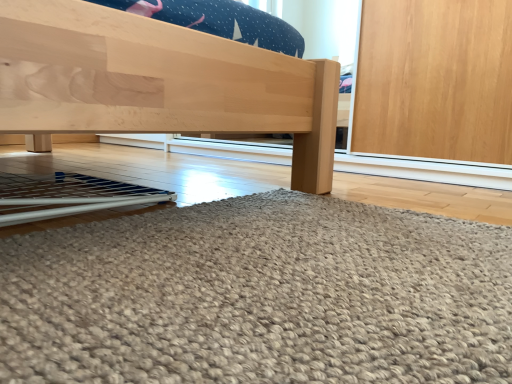
This screenshot has height=384, width=512. I want to click on wooden door at lower right, so click(x=260, y=297).

What do you see at coordinates (260, 297) in the screenshot? I see `wooden door at lower right` at bounding box center [260, 297].

What do you see at coordinates (158, 83) in the screenshot? This screenshot has height=384, width=512. I see `natural wood bed frame at center` at bounding box center [158, 83].

Identify the location of natural wood bed frame at center. point(158,83).

I want to click on wooden door at lower right, so click(260, 297).

Is wooden door at lower right to the right of natural wood bed frame at center from the viewer's perspective?

Indeed, wooden door at lower right is positioned on the right side of natural wood bed frame at center.

Does wooden door at lower right lie behind natural wood bed frame at center?

No, wooden door at lower right is closer to the viewer.

Considering the points (271, 265) and (324, 116), which point is in front, point (271, 265) or point (324, 116)?

Positioned in front is point (271, 265).

From the image's perspective, is wooden door at lower right above or below natural wood bed frame at center?

wooden door at lower right is situated lower than natural wood bed frame at center in the image.

From a real-world perspective, is wooden door at lower right below natural wood bed frame at center?

Correct, in the physical world, wooden door at lower right is lower than natural wood bed frame at center.

Is wooden door at lower right wider or thinner than natural wood bed frame at center?

wooden door at lower right is thinner than natural wood bed frame at center.

Which of these two, wooden door at lower right or natural wood bed frame at center, stands taller?

natural wood bed frame at center.

Considering the relative sizes of wooden door at lower right and natural wood bed frame at center in the image provided, is wooden door at lower right smaller than natural wood bed frame at center?

Yes, wooden door at lower right is smaller than natural wood bed frame at center.

Would you say wooden door at lower right is outside natural wood bed frame at center?

wooden door at lower right lies outside natural wood bed frame at center's area.

Is wooden door at lower right beside natural wood bed frame at center?

wooden door at lower right and natural wood bed frame at center are clearly separated.

Is natural wood bed frame at center at the back of wooden door at lower right?

wooden door at lower right is not turned away from natural wood bed frame at center.

How different are the orientations of wooden door at lower right and natural wood bed frame at center in degrees?

The facing directions of wooden door at lower right and natural wood bed frame at center are 86.6 degrees apart.

Identify the location of door located below the natural wood bed frame at center (from the image's perspective). (260, 297).

Between natural wood bed frame at center and wooden door at lower right, which one appears on the left side from the viewer's perspective?

Positioned to the left is natural wood bed frame at center.

Relative to wooden door at lower right, is natural wood bed frame at center in front or behind?

natural wood bed frame at center is positioned farther from the viewer than wooden door at lower right.

Does point (139, 121) appear closer or farther from the camera than point (489, 373)?

Point (139, 121).

From the image's perspective, is natural wood bed frame at center located above wooden door at lower right?

Yes, from the image's perspective, natural wood bed frame at center is above wooden door at lower right.

From a real-world perspective, which object stands above the other?

From a 3D spatial view, natural wood bed frame at center is above.

Between natural wood bed frame at center and wooden door at lower right, which one has larger width?

natural wood bed frame at center is wider.

From the picture: Who is taller, natural wood bed frame at center or wooden door at lower right?

natural wood bed frame at center.

From the picture: Who is bigger, natural wood bed frame at center or wooden door at lower right?

natural wood bed frame at center.

Is natural wood bed frame at center positioned beyond the bounds of wooden door at lower right?

Yes.

Based on the photo, is natural wood bed frame at center next to wooden door at lower right?

natural wood bed frame at center is not next to wooden door at lower right, and they're not touching.

Is natural wood bed frame at center facing away from wooden door at lower right?

That's not correct — natural wood bed frame at center is not looking away from wooden door at lower right.

What's the angular difference between natural wood bed frame at center and wooden door at lower right's facing directions?

There is a 86.6-degree angle between the facing directions of natural wood bed frame at center and wooden door at lower right.

The height and width of the screenshot is (384, 512). In order to click on furniture above the wooden door at lower right (from a real-world perspective) in this screenshot , I will do `click(158, 83)`.

Where is `furniture on the left of the wooden door at lower right`? The height and width of the screenshot is (384, 512). furniture on the left of the wooden door at lower right is located at coordinates (158, 83).

Locate an element on the screen. The width and height of the screenshot is (512, 384). door below the natural wood bed frame at center (from a real-world perspective) is located at coordinates (260, 297).